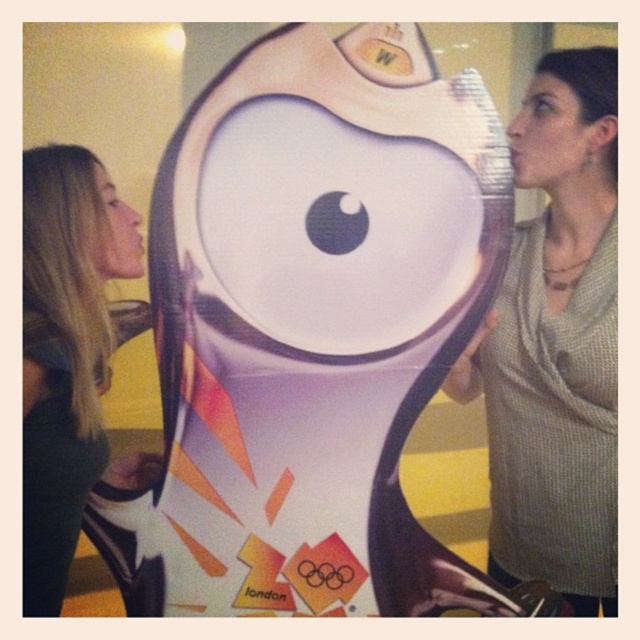
Question: Which point is closer to the camera?

Choices:
 (A) matte gray sweater at right
 (B) blonde hair at left

Answer: (B)

Question: Can you confirm if matte gray sweater at right is thinner than blonde hair at left?

Choices:
 (A) yes
 (B) no

Answer: (B)

Question: Is matte gray sweater at right thinner than blonde hair at left?

Choices:
 (A) yes
 (B) no

Answer: (B)

Question: In this image, where is matte gray sweater at right located relative to blonde hair at left?

Choices:
 (A) below
 (B) above

Answer: (B)

Question: Which of the following is the farthest from the observer?

Choices:
 (A) (92, 211)
 (B) (577, 420)

Answer: (B)